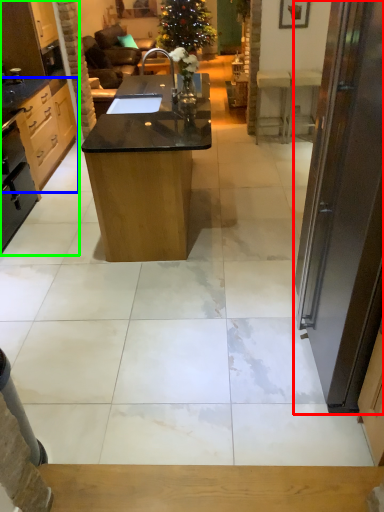
Question: Which object is the closest to the door (highlighted by a red box)? Choose among these: cabinetry (highlighted by a blue box) or cabinetry (highlighted by a green box).

Choices:
 (A) cabinetry
 (B) cabinetry

Answer: (B)